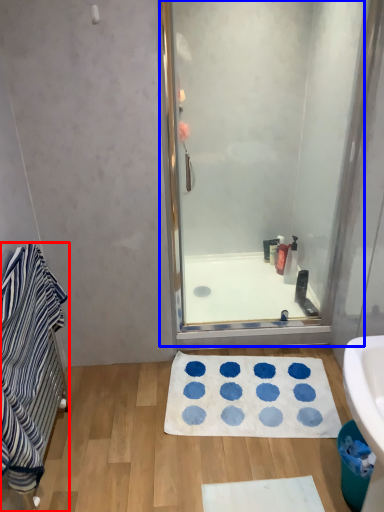
Question: Which point is further to the camera, bathroom cabinet (highlighted by a red box) or shower door (highlighted by a blue box)?

Choices:
 (A) bathroom cabinet
 (B) shower door

Answer: (B)